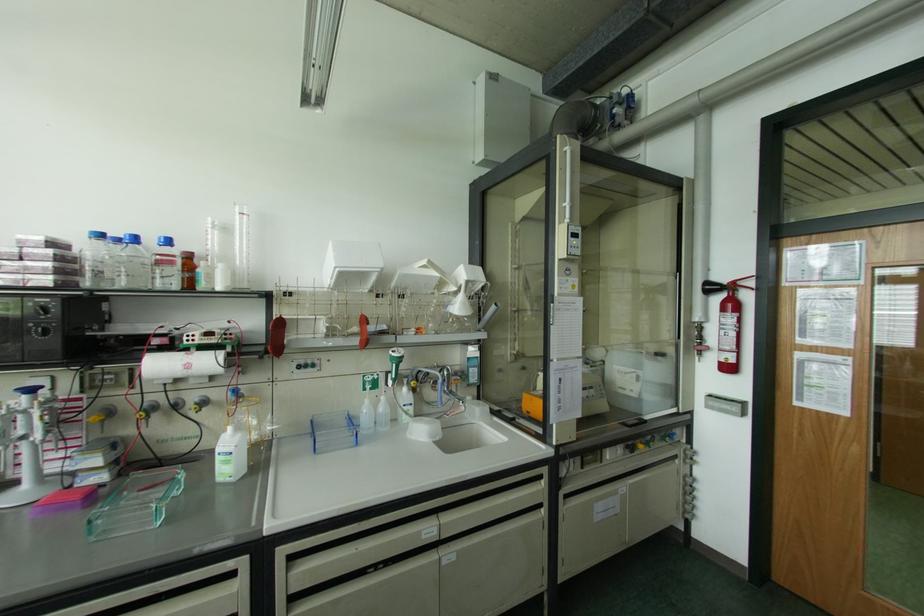
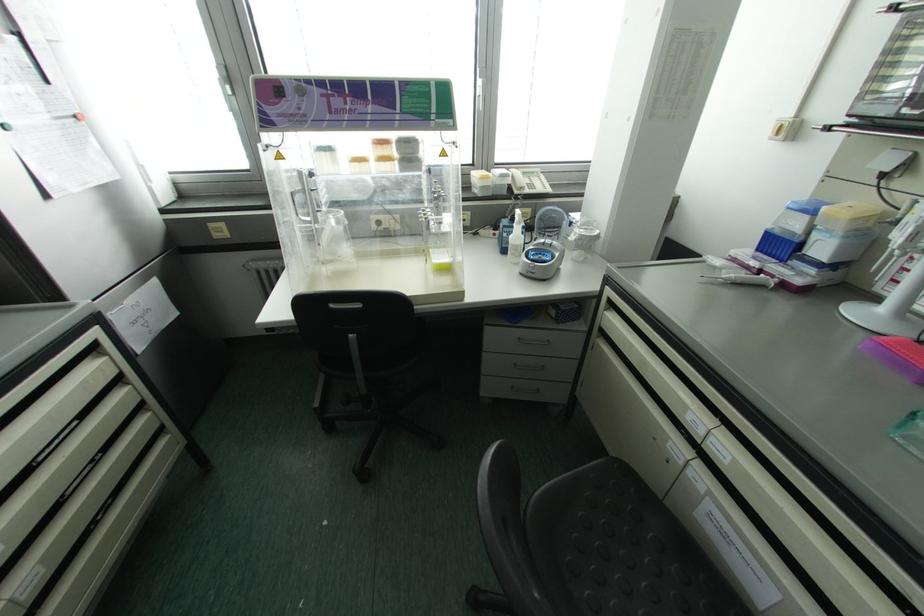
The images are taken continuously from a first-person perspective. In which direction is your viewpoint rotating?

The camera rotated toward left-down.